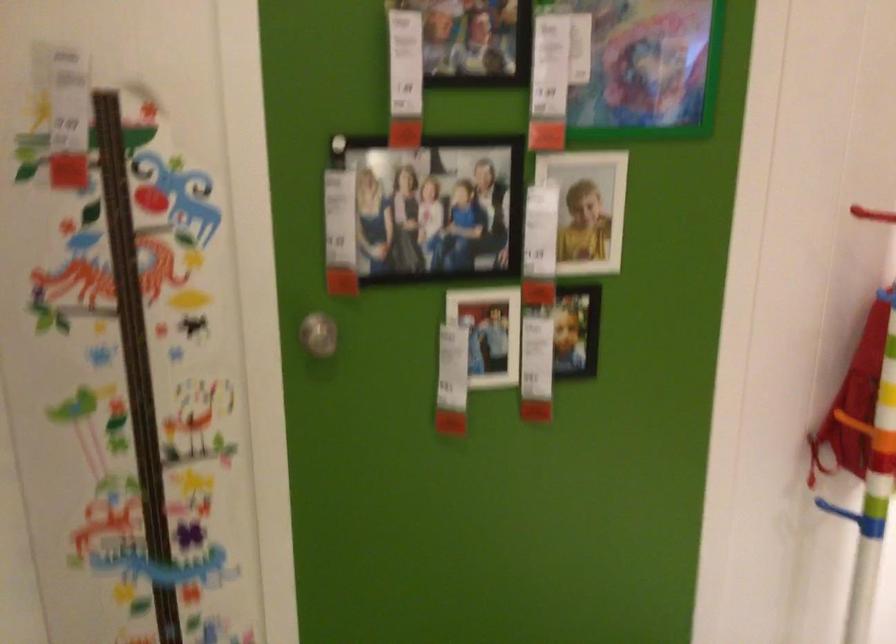
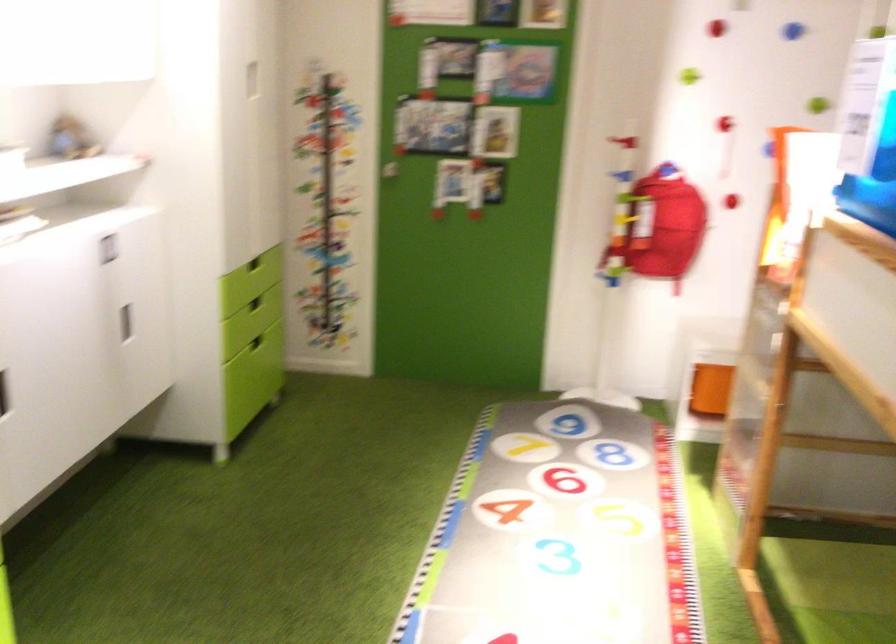
In the scene shown: The images are taken continuously from a first-person perspective. In which direction are you moving?

The cameraman walked toward right, backward.